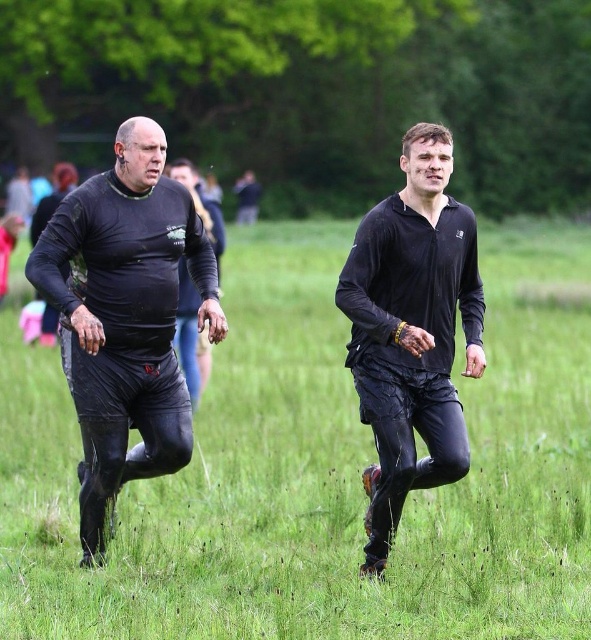
Is black matte clothing at left smaller than matte black rugby ball at left?

No, black matte clothing at left is not smaller than matte black rugby ball at left.

Can you confirm if black matte clothing at left is wider than matte black rugby ball at left?

Indeed, black matte clothing at left has a greater width compared to matte black rugby ball at left.

Describe the element at coordinates (125, 316) in the screenshot. This screenshot has height=640, width=591. I see `black matte clothing at left` at that location.

Where is `black matte clothing at left`? black matte clothing at left is located at coordinates (125, 316).

Consider the image. Is wet black pants at center thinner than matte black rugby ball at left?

No, wet black pants at center is not thinner than matte black rugby ball at left.

This screenshot has height=640, width=591. What do you see at coordinates (317, 468) in the screenshot? I see `wet black pants at center` at bounding box center [317, 468].

Does point (557, 474) come in front of point (193, 179)?

Yes, point (557, 474) is in front of point (193, 179).

Where is `wet black pants at center`? This screenshot has width=591, height=640. wet black pants at center is located at coordinates pyautogui.click(x=317, y=468).

Which is behind, point (420, 241) or point (180, 298)?

The point (180, 298) is behind.

This screenshot has height=640, width=591. What do you see at coordinates (411, 330) in the screenshot? I see `black matte jacket at center` at bounding box center [411, 330].

Where is `black matte jacket at center`? The width and height of the screenshot is (591, 640). black matte jacket at center is located at coordinates click(x=411, y=330).

Identify the location of black matte jacket at center. (411, 330).